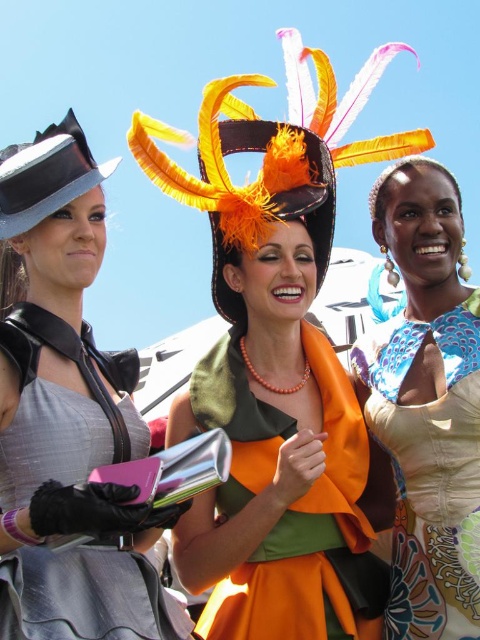
You are a photographer trying to capture a group photo of the matte orange dress at center and the matte black hat at left. Based on their positions, which object should you place your camera closer to in order to ensure both are centered in the frame?

The matte orange dress at center is positioned on the right side of the matte black hat at left. To center both in the frame, the camera should be placed closer to the matte black hat at left since the dress is further to the right.

You are a photographer standing at the camera position. You want to take a closeup shot of the matte black dress at left. Considering the distance, will you need to use a zoom lens?

The matte black dress at left is 50.84 meters away from camera, so you will need to use a zoom lens to capture a closeup shot.

Based on the scene description, which object is taller between the orange matte fabric dress at center and the orange feathered hat at center?

The orange feathered hat at center is taller than the orange matte fabric dress at center.